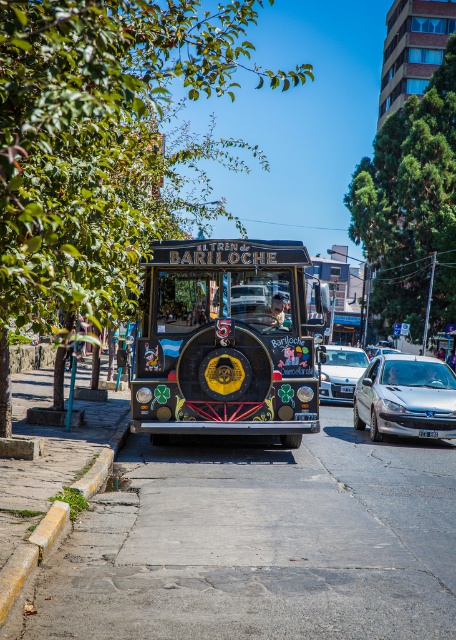
Question: Is decorative painted bus at center to the left of silver metallic car at center from the viewer's perspective?

Choices:
 (A) yes
 (B) no

Answer: (A)

Question: Which point is farther to the camera?

Choices:
 (A) (332, 362)
 (B) (304, 342)
 (C) (367, 620)
 (D) (440, 422)

Answer: (A)

Question: Is silver metallic car at right thinner than silver metallic car at center?

Choices:
 (A) no
 (B) yes

Answer: (B)

Question: Among these points, which one is nearest to the camera?

Choices:
 (A) (119, 424)
 (B) (347, 355)
 (C) (181, 321)

Answer: (C)

Question: Does decorative painted bus at center have a lesser width compared to silver metallic car at right?

Choices:
 (A) yes
 (B) no

Answer: (B)

Question: Which of these objects is positioned closest to the paved concrete sidewalk at center?

Choices:
 (A) yellow concrete curb at lower left
 (B) silver metallic car at center
 (C) decorative painted bus at center

Answer: (A)